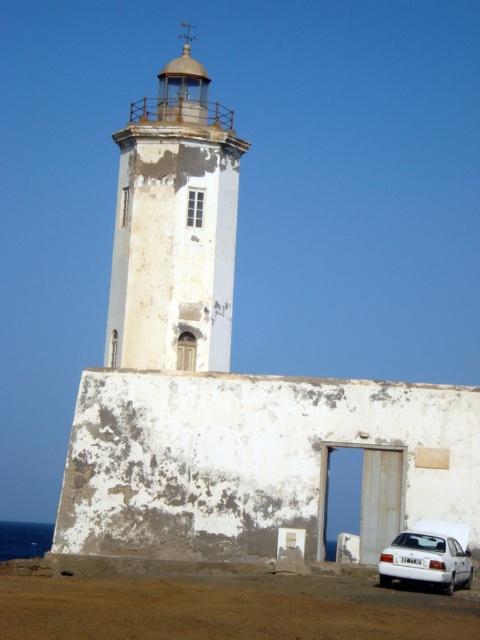
You are standing at the camera position looking at the lighthouse. If you walk directly towards the point at coordinates point (x=154, y=116), how far will you have to walk to reach it?

You will have to walk 49.90 meters to reach the point (x=154, y=116) from your current position at the camera.

You are standing at the base of the white weathered tower at center and want to see the white matte car at lower right. Can you see it from your current position?

The white matte car at lower right is behind the white weathered tower at center, so you cannot see it from your current position at the base of the tower.